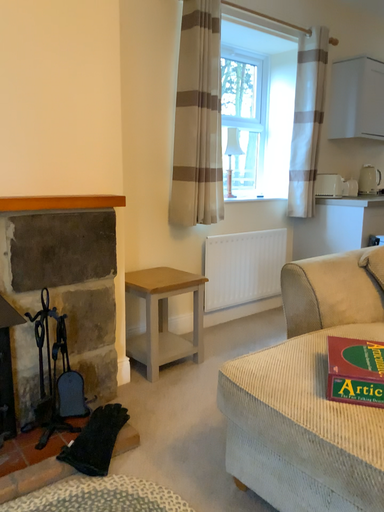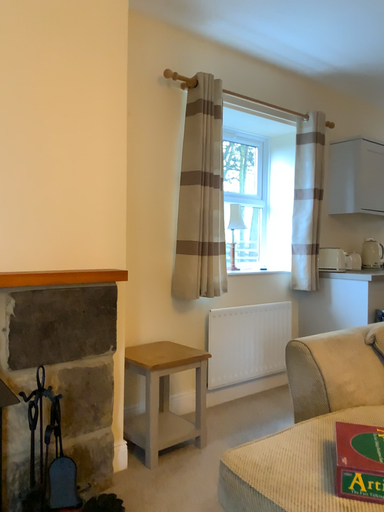
Question: How did the camera likely rotate when shooting the video?

Choices:
 (A) rotated downward
 (B) rotated upward

Answer: (B)